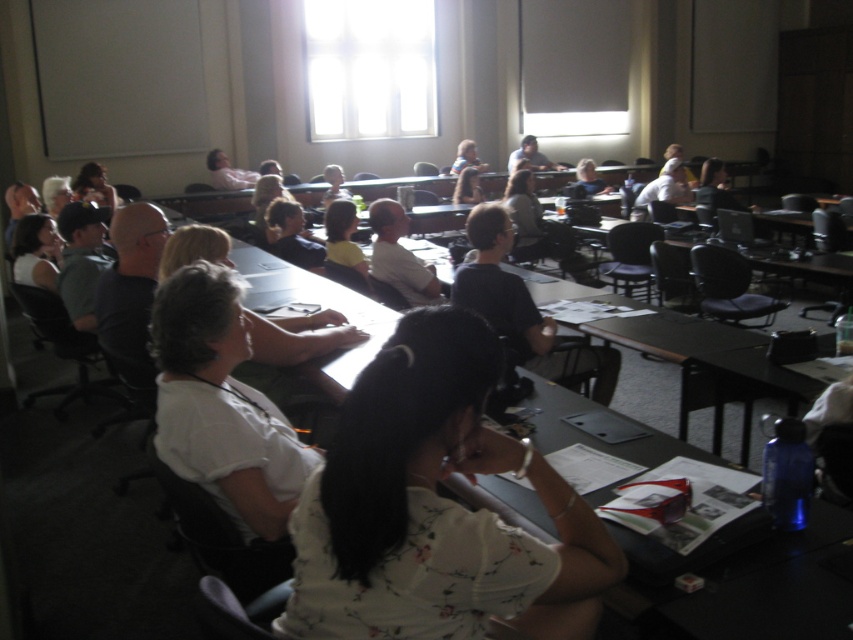
Based on the photo, which is above, white floral shirt at center or matte black laptop at center?

matte black laptop at center is higher up.

Which is below, white floral shirt at center or matte black laptop at center?

white floral shirt at center is lower down.

Who is more distant from viewer, [436,470] or [471,193]?

Point [471,193]

This screenshot has width=853, height=640. Find the location of `white floral shirt at center`. white floral shirt at center is located at coordinates (434, 508).

Is matte white shirt at upper left thinner than matte black laptop at center?

Incorrect, matte white shirt at upper left's width is not less than matte black laptop at center's.

In order to click on matte white shirt at upper left in this screenshot , I will do `click(36, 252)`.

Does white floral shirt at center appear on the left side of matte white shirt at upper left?

In fact, white floral shirt at center is to the right of matte white shirt at upper left.

Can you confirm if white floral shirt at center is wider than matte white shirt at upper left?

In fact, white floral shirt at center might be narrower than matte white shirt at upper left.

Does point (473, 380) come in front of point (38, 230)?

Yes.

Where is `white floral shirt at center`? The width and height of the screenshot is (853, 640). white floral shirt at center is located at coordinates (434, 508).